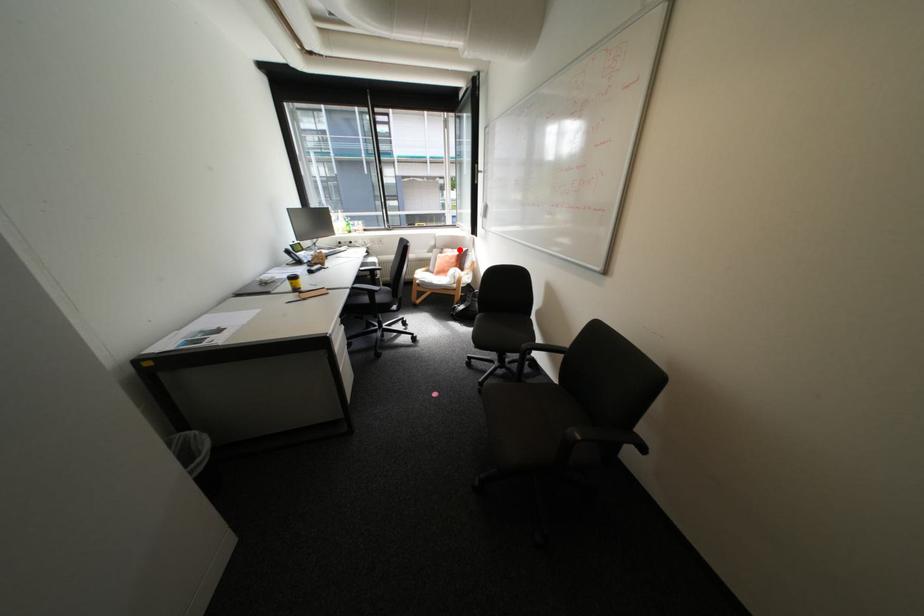
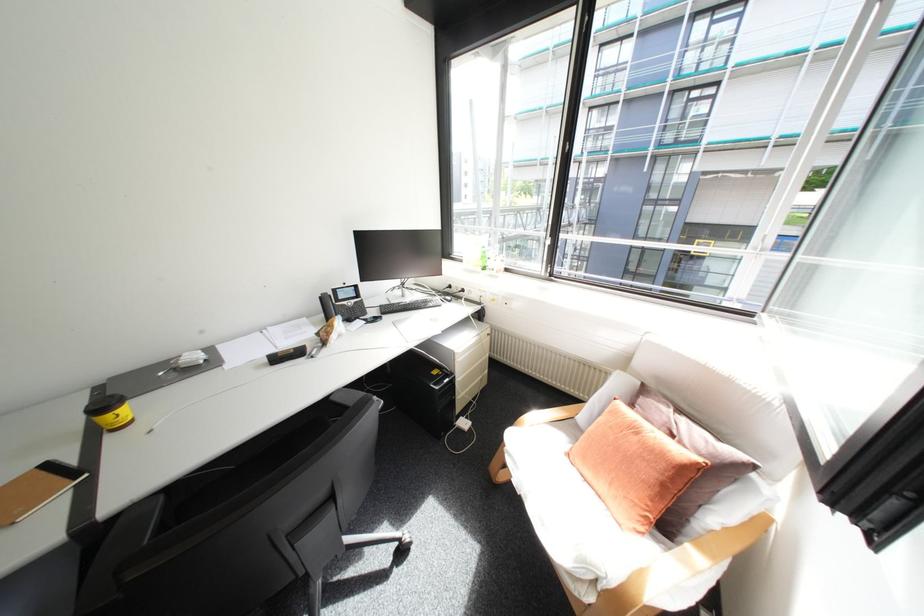
The point at the highlighted location is marked in the first image. Where is the corresponding point in the second image?

(677, 410)